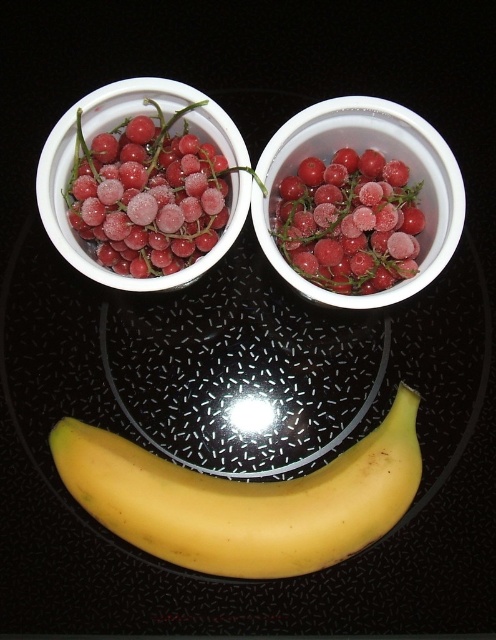
You are planning to arrange fruits on a similar dark surface. If you want to place a new fruit between the yellow smooth banana at bottom and the frozen red berries at upper left, which fruit should you choose based on size? The options are a small cherry or a large apple.

The yellow smooth banana at bottom is wider than the frozen red berries at upper left. Therefore, you should choose the large apple to fit between them, as it can accommodate the size difference.

You are a food stylist trying to place a decorative sticker on the exact center of the yellow smooth banana at bottom. According to the coordinates provided, where should you place the sticker?

The sticker should be placed at the center point of the yellow smooth banana at bottom, which is at coordinates point (245, 499).

You are a food stylist arranging a fruit platter. You have a yellow smooth banana at bottom and frozen red berries at upper left. Which item is taller in the arrangement?

The yellow smooth banana at bottom is taller than the frozen red berries at upper left.